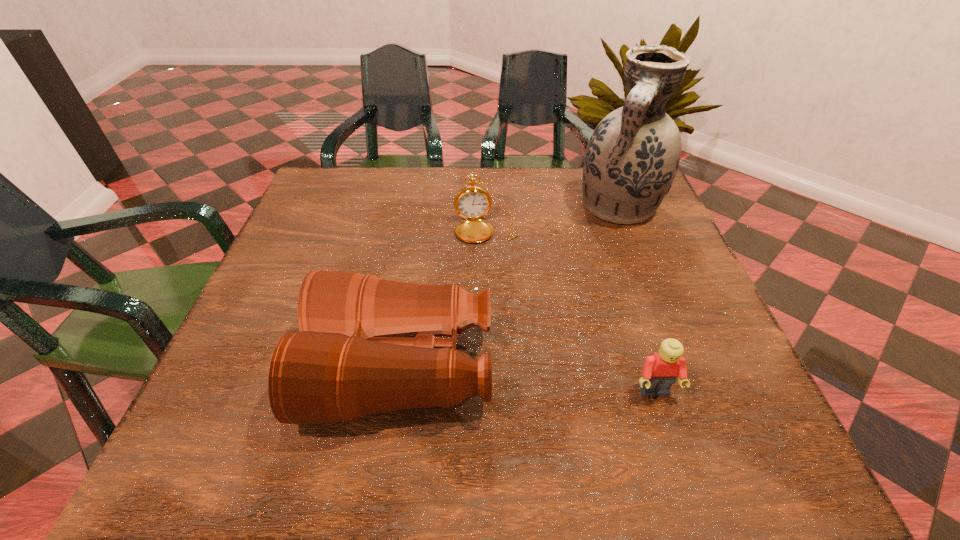
Find the location of `object that is at the near right corner`. object that is at the near right corner is located at coordinates (660, 371).

Find the location of a particular element. free space at the far edge is located at coordinates (582, 171).

The height and width of the screenshot is (540, 960). Identify the location of vacant region at the near edge. [647, 410].

Find the location of `vacant space at the left edge of the desktop`. vacant space at the left edge of the desktop is located at coordinates (247, 352).

Where is `free space at the far left corner of the desktop`? This screenshot has height=540, width=960. free space at the far left corner of the desktop is located at coordinates (346, 179).

Where is `vacant space in between the pocket watch and the tallest object`? The width and height of the screenshot is (960, 540). vacant space in between the pocket watch and the tallest object is located at coordinates (553, 218).

The width and height of the screenshot is (960, 540). In order to click on free area in between the pocket watch and the Lego in this screenshot , I will do `click(570, 310)`.

I want to click on vacant space that is in between the vase and the pocket watch, so 553,218.

Image resolution: width=960 pixels, height=540 pixels. In order to click on free space between the vase and the pocket watch in this screenshot , I will do `click(553, 218)`.

Identify the location of blank region between the binoculars and the tallest object. This screenshot has width=960, height=540. (511, 287).